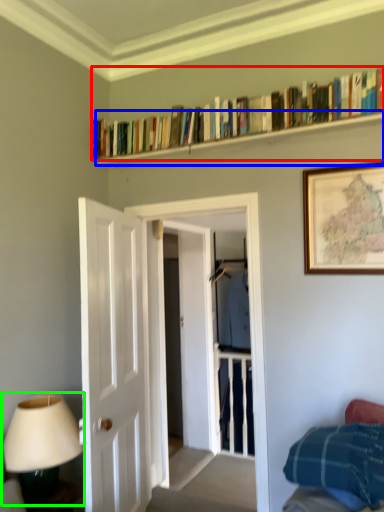
Question: Which is farther away from book (highlighted by a red box)? shelf (highlighted by a blue box) or table lamp (highlighted by a green box)?

Choices:
 (A) shelf
 (B) table lamp

Answer: (B)